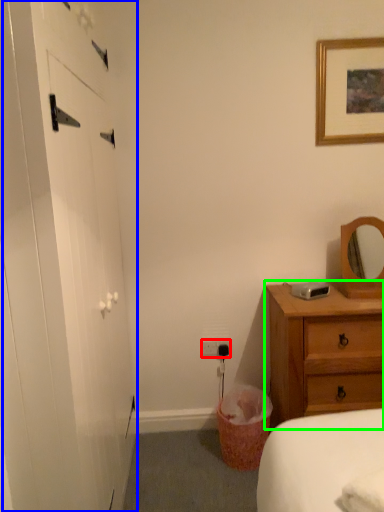
Question: Estimate the real-world distances between objects in this image. Which object is farther from electric outlet (highlighted by a red box), barn door (highlighted by a blue box) or chest of drawers (highlighted by a green box)?

Choices:
 (A) barn door
 (B) chest of drawers

Answer: (A)